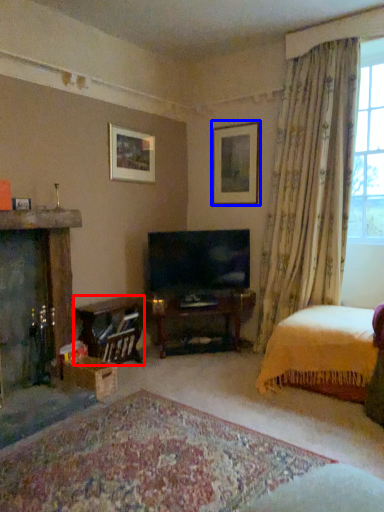
Question: Which object appears farthest to the camera in this image, table (highlighted by a red box) or picture frame (highlighted by a blue box)?

Choices:
 (A) table
 (B) picture frame

Answer: (B)